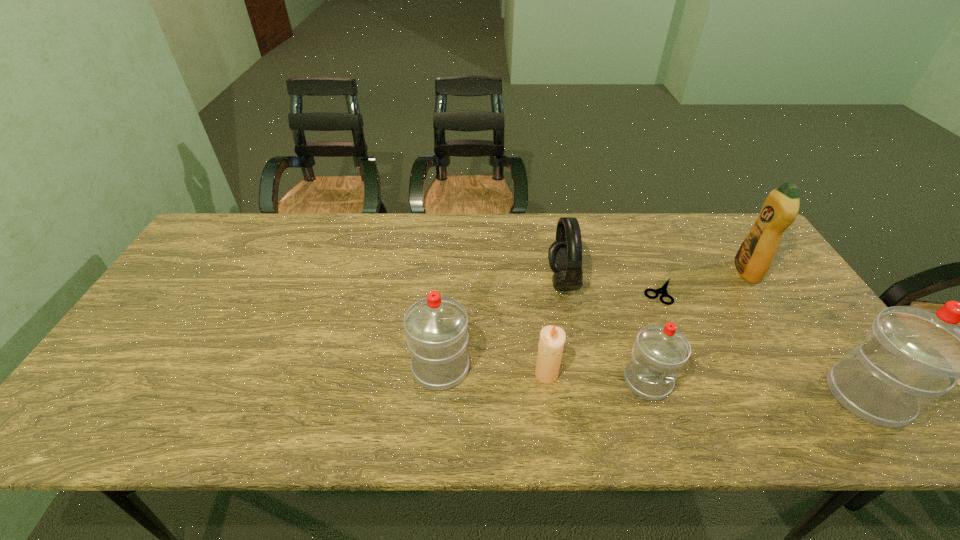
Image resolution: width=960 pixels, height=540 pixels. What are the coordinates of `vacant space located 0.270m on the handle side of the leftmost object` in the screenshot? It's located at (448, 273).

Locate an element on the screen. The image size is (960, 540). blank area located 0.270m on the handle side of the leftmost object is located at coordinates point(448,273).

At what (x,y) coordinates should I click in order to perform the action: click on vacant position located 0.270m on the handle side of the leftmost object. Please return your answer as a coordinate pair (x, y). The image size is (960, 540). Looking at the image, I should click on (448, 273).

Locate an element on the screen. free space located 0.130m on the handle side of the rightmost water bottle is located at coordinates (815, 325).

Find the location of `free space located 0.280m on the handle side of the rightmost water bottle`. free space located 0.280m on the handle side of the rightmost water bottle is located at coordinates (786, 286).

The image size is (960, 540). What are the coordinates of `vacant region located 0.070m on the handle side of the rightmost water bottle` in the screenshot? It's located at (828, 343).

I want to click on vacant area situated 0.250m on the earcups of the fifth object from right to left, so click(x=464, y=281).

Locate an element on the screen. The height and width of the screenshot is (540, 960). vacant area situated on the earcups of the fifth object from right to left is located at coordinates (521, 281).

Find the location of a particular element. This screenshot has height=540, width=960. vacant space located 0.340m on the earcups of the fifth object from right to left is located at coordinates (433, 281).

The width and height of the screenshot is (960, 540). I want to click on vacant space located on the label of the detergent, so click(672, 272).